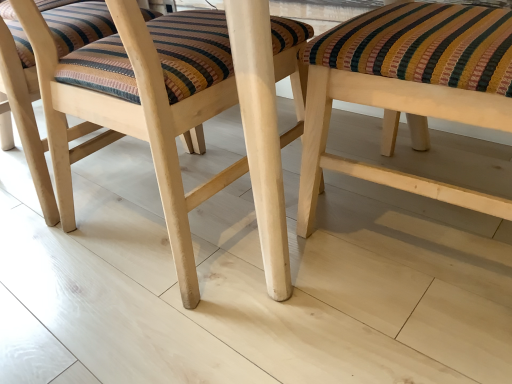
I want to click on vacant region to the left of natural wood stool at center, the 1th stool positioned from the left, so click(x=56, y=224).